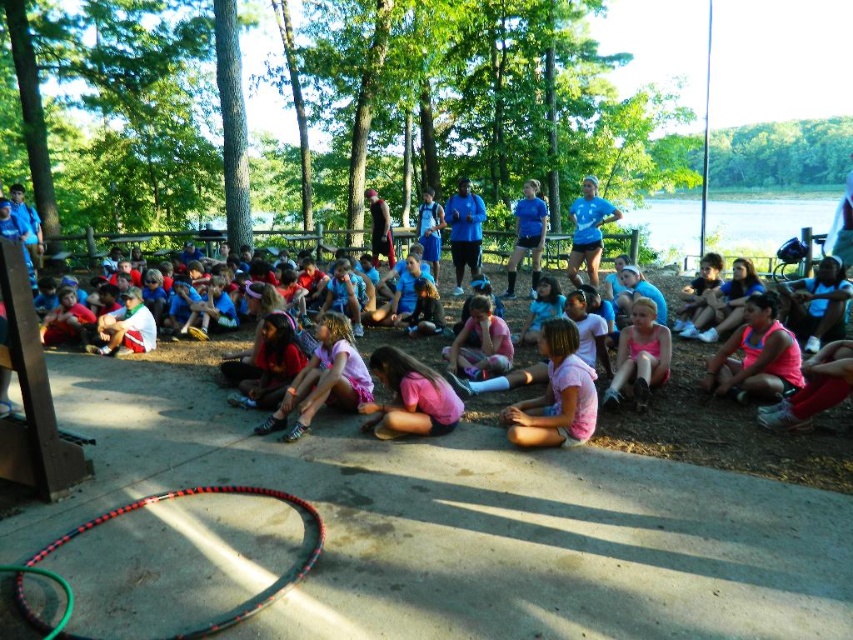
Question: Can you confirm if clear blue water at upper center is thinner than multicolored plastic hula hoop at lower center?

Choices:
 (A) no
 (B) yes

Answer: (A)

Question: Which point is farther from the camera taking this photo?

Choices:
 (A) (32, 627)
 (B) (590, 225)

Answer: (B)

Question: Among these points, which one is farthest from the camera?

Choices:
 (A) (102, 518)
 (B) (827, 218)
 (C) (585, 189)

Answer: (B)

Question: Which object appears closest to the camera in this image?

Choices:
 (A) multicolored plastic hula hoop at lower center
 (B) blue fabric shorts at center

Answer: (A)

Question: Can you confirm if clear blue water at upper center is thinner than multicolored plastic hula hoop at lower center?

Choices:
 (A) no
 (B) yes

Answer: (A)

Question: Does clear blue water at upper center have a lesser width compared to blue fabric shorts at center?

Choices:
 (A) no
 (B) yes

Answer: (A)